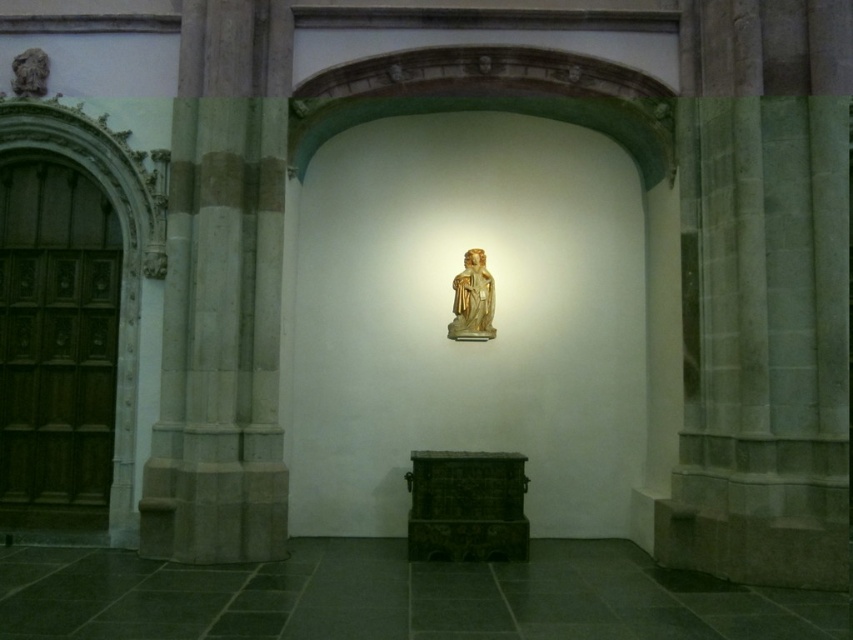
You are an architect examining the interior of a historical building. You notice the smooth stone pillar at left and the gold polished wood statue at center. Which object is positioned to the left of the other?

The smooth stone pillar at left is positioned to the left of the gold polished wood statue at center.

You are an interior designer planning to place a new decorative item in this historical space. You have a choice between placing it next to the smooth stone pillar at left or near the gold polished wood statue at center. If you want the item to be placed where there is more space, which location should you choose?

The smooth stone pillar at left has a larger width than the gold polished wood statue at center, so placing the item next to the smooth stone pillar at left would provide more space.

Based on the photo, you are standing in the historical building and want to determine which of the two points, point (253, 289) or point (461, 291), is nearer to you. Based on the scene, which point is closer?

Point (253, 289) is closer to the viewer than point (461, 291).